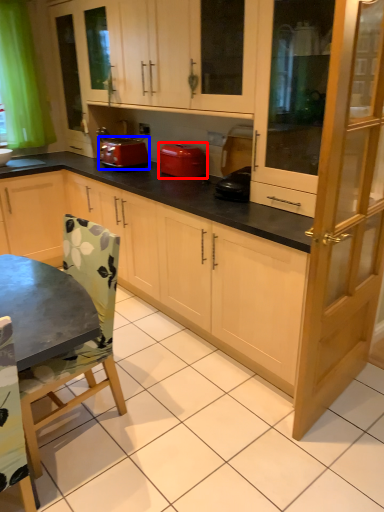
Question: Among these objects, which one is farthest to the camera, home appliance (highlighted by a red box) or kitchen appliance (highlighted by a blue box)?

Choices:
 (A) home appliance
 (B) kitchen appliance

Answer: (B)